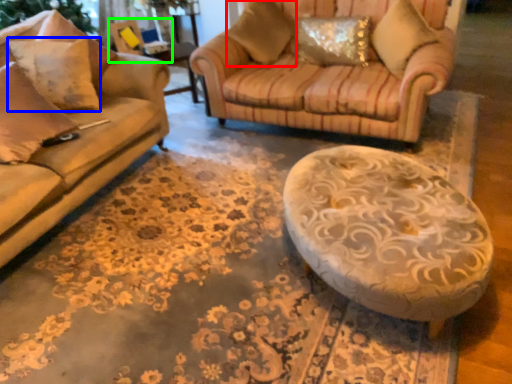
Question: Considering the real-world distances, which object is farthest from pillow (highlighted by a red box)? pillow (highlighted by a blue box) or swivel chair (highlighted by a green box)?

Choices:
 (A) pillow
 (B) swivel chair

Answer: (A)